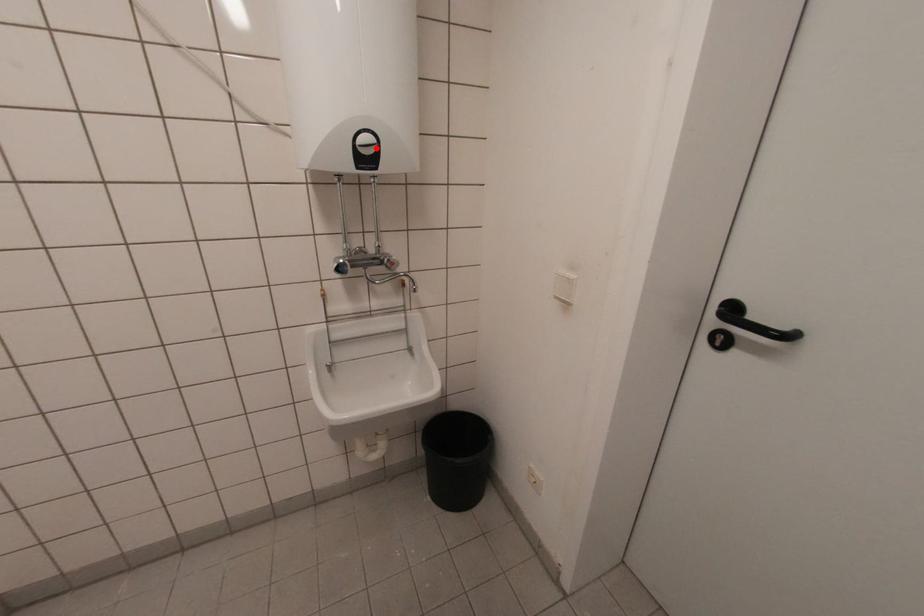
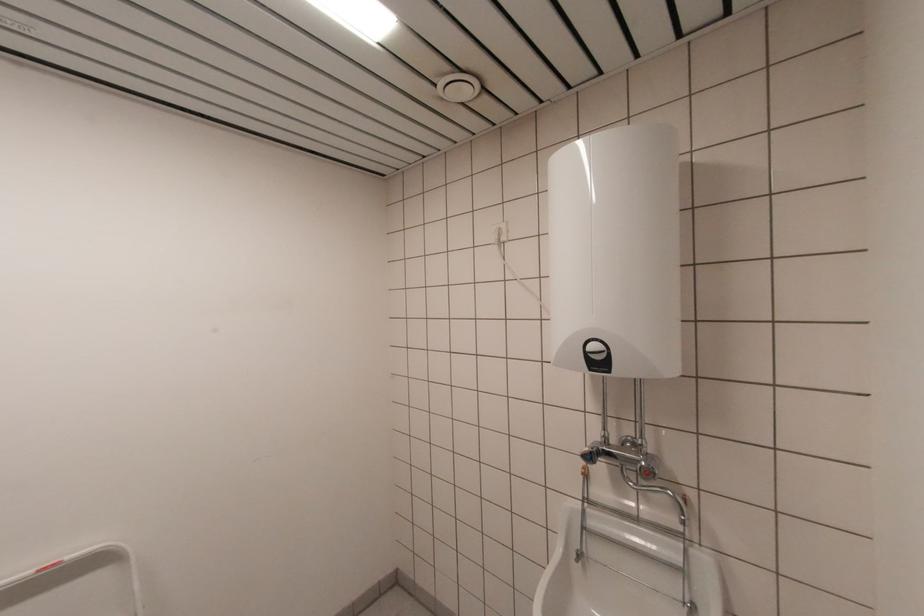
Where in the second image is the point corresponding to the highlighted location from the first image?

(605, 354)